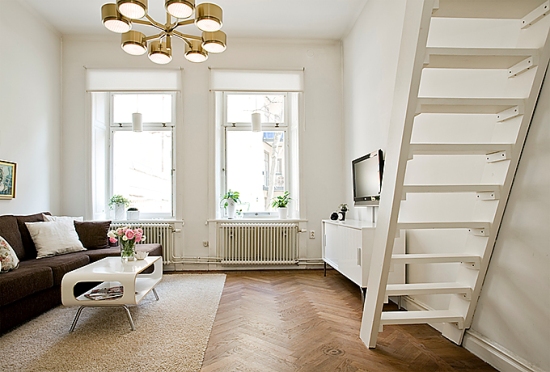
The image size is (550, 372). Find the location of `hardwood floors`. hardwood floors is located at coordinates (292, 323).